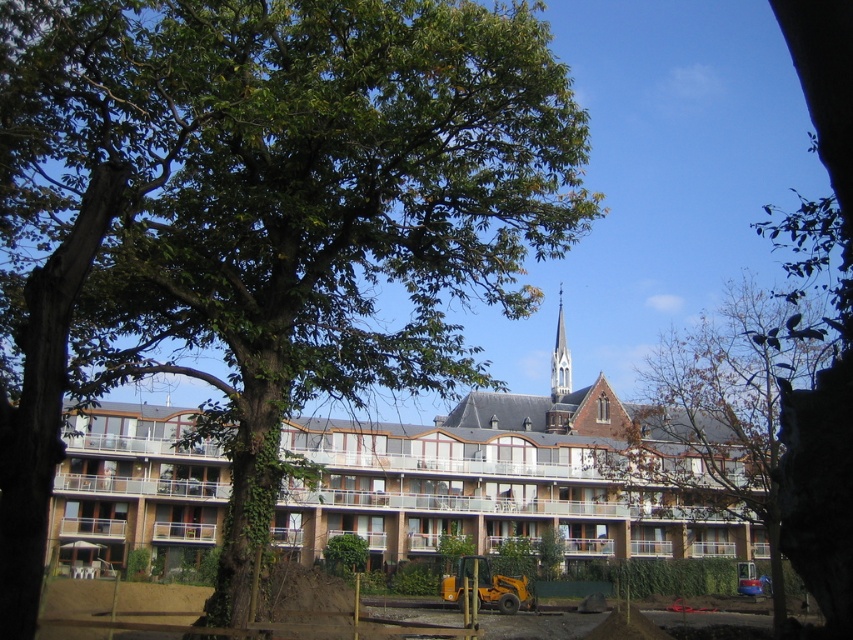
Question: Which object appears farthest from the camera in this image?

Choices:
 (A) brown leafy tree at center
 (B) brown brick building at center
 (C) green leafy tree at center

Answer: (B)

Question: Which point is closer to the camera?

Choices:
 (A) (390, 452)
 (B) (515, 67)

Answer: (B)

Question: Does brown leafy tree at center appear over smooth white steeple at upper center?

Choices:
 (A) yes
 (B) no

Answer: (B)

Question: Can you confirm if green leafy tree at center is positioned to the left of smooth white steeple at upper center?

Choices:
 (A) no
 (B) yes

Answer: (B)

Question: Is green leafy tree at center below smooth white steeple at upper center?

Choices:
 (A) no
 (B) yes

Answer: (A)

Question: Among these points, which one is nearest to the camera?

Choices:
 (A) (762, 413)
 (B) (569, 385)

Answer: (A)